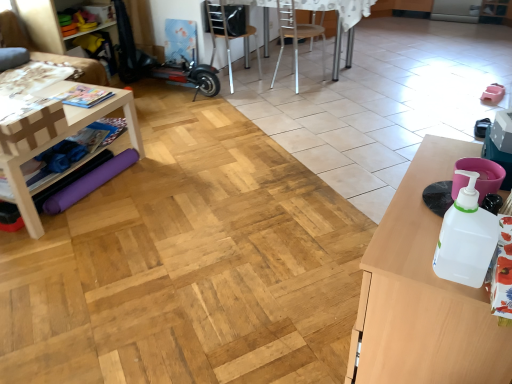
I want to click on vacant area that lies between wooden table at right, marked as the 2th table in a back-to-front arrangement, and white wood table at left, the first table positioned from the left, so click(x=197, y=253).